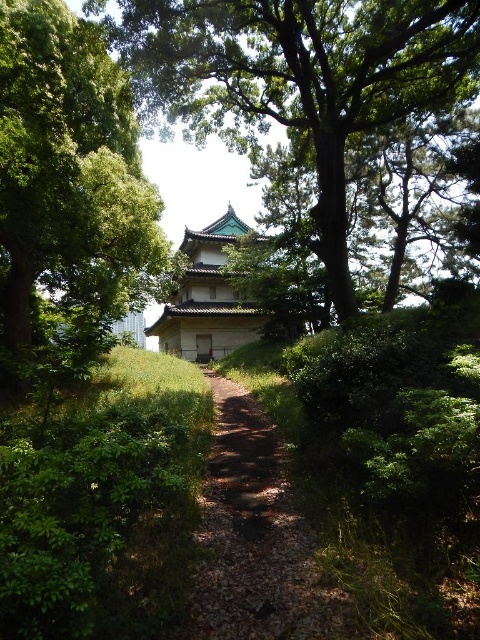
You are a visitor at this Japanese garden and want to take a photo of both the green leafy tree at center and the green stone pagoda at center. Which object should you focus on first if you want to ensure both are in the frame without moving the camera?

The green leafy tree at center is shorter than the green stone pagoda at center, so focus on the green leafy tree at center first to ensure both are in the frame.

You are a visitor walking along the dirt path at center towards the Japanese building. There is a green textured tree at center blocking your view. Can you see the building through the tree?

The green textured tree at center is located above the dirt path at center, so it might block your view of the building. You may need to move to the side or look around the tree to see the building.